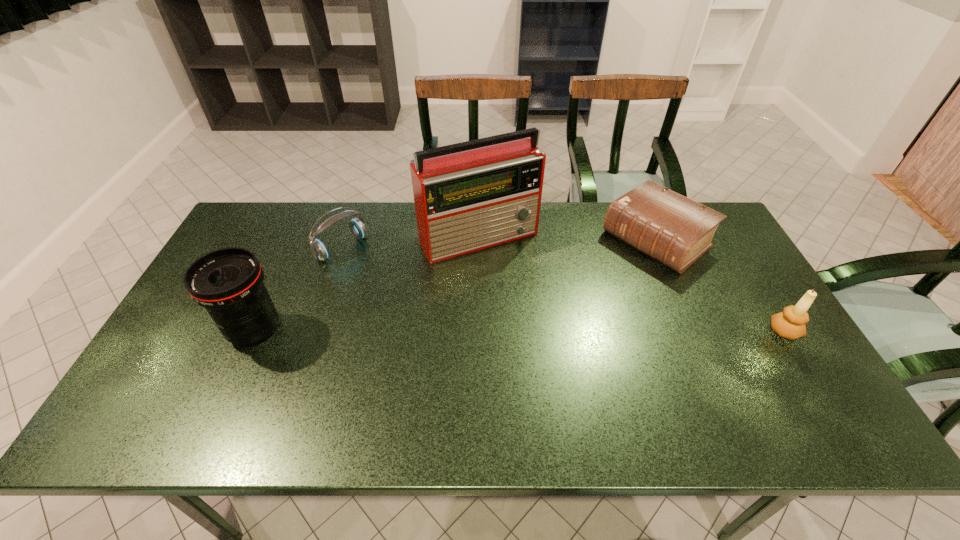
At what (x,y) coordinates should I click in order to perform the action: click on telephoto lens. Please return your answer as a coordinate pair (x, y). Looking at the image, I should click on (228, 282).

At what (x,y) coordinates should I click in order to perform the action: click on the rightmost object. Please return your answer as a coordinate pair (x, y). The height and width of the screenshot is (540, 960). Looking at the image, I should click on (790, 324).

Identify the location of the fourth object from left to right. (676, 231).

Find the location of a particular element. The width and height of the screenshot is (960, 540). headset is located at coordinates (319, 250).

In order to click on radio receiver in this screenshot , I will do [x=468, y=196].

Identify the location of the third object from right to left. (468, 196).

At what (x,y) coordinates should I click in order to perform the action: click on vacant space located 0.060m on the back of the second tallest object. Please return your answer as a coordinate pair (x, y). Looking at the image, I should click on (273, 292).

Image resolution: width=960 pixels, height=540 pixels. In order to click on vacant space located on the back of the rightmost object in this screenshot , I will do `click(748, 272)`.

You are a GUI agent. You are given a task and a screenshot of the screen. Output one action in this format:
    pyautogui.click(x=<x>, y=<y>)
    Task: Click on the vacant space situated on the spine side of the Bible
    
    Given the screenshot: What is the action you would take?
    [590, 289]

This screenshot has height=540, width=960. I want to click on vacant space situated 0.170m on the spine side of the Bible, so click(588, 291).